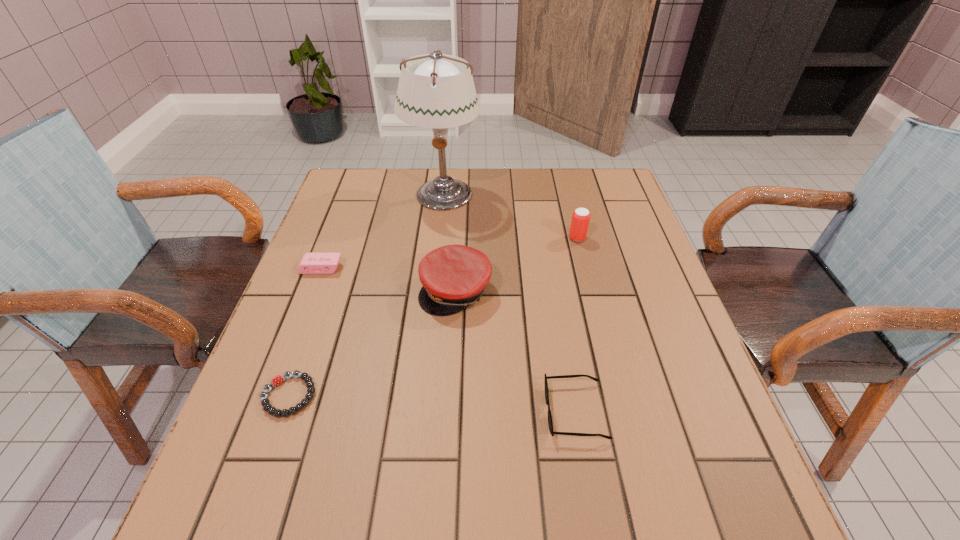
Identify the location of vacant area that lies between the tallest object and the shortest object. Image resolution: width=960 pixels, height=540 pixels. (366, 295).

In order to click on empty space that is in between the cap and the shortest object in this screenshot , I will do `click(372, 343)`.

I want to click on unoccupied position between the cap and the farthest object, so click(449, 242).

Where is `empty space between the bracelet and the eraser`? This screenshot has width=960, height=540. empty space between the bracelet and the eraser is located at coordinates (305, 332).

Where is `vacant space in between the eraser and the shortest object`? vacant space in between the eraser and the shortest object is located at coordinates (305, 332).

Find the location of a particular element. The image size is (960, 540). free space between the cap and the eraser is located at coordinates (388, 279).

The height and width of the screenshot is (540, 960). I want to click on object that is the third closest to the second farthest object, so pyautogui.click(x=550, y=423).

This screenshot has height=540, width=960. In order to click on object that is the fifth closest one to the eraser in this screenshot , I will do `click(580, 220)`.

Image resolution: width=960 pixels, height=540 pixels. Find the location of `vacant position in the image that satisfies the following two spatial constraints: 1. on the back side of the fifth nearest object; 2. on the left side of the eraser`. vacant position in the image that satisfies the following two spatial constraints: 1. on the back side of the fifth nearest object; 2. on the left side of the eraser is located at coordinates (332, 238).